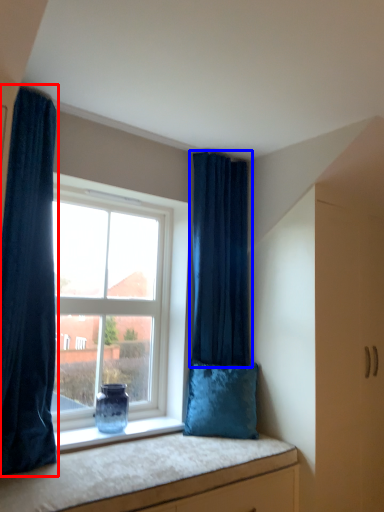
Question: Which of the following is the farthest to the observer, curtain (highlighted by a red box) or curtain (highlighted by a blue box)?

Choices:
 (A) curtain
 (B) curtain

Answer: (B)